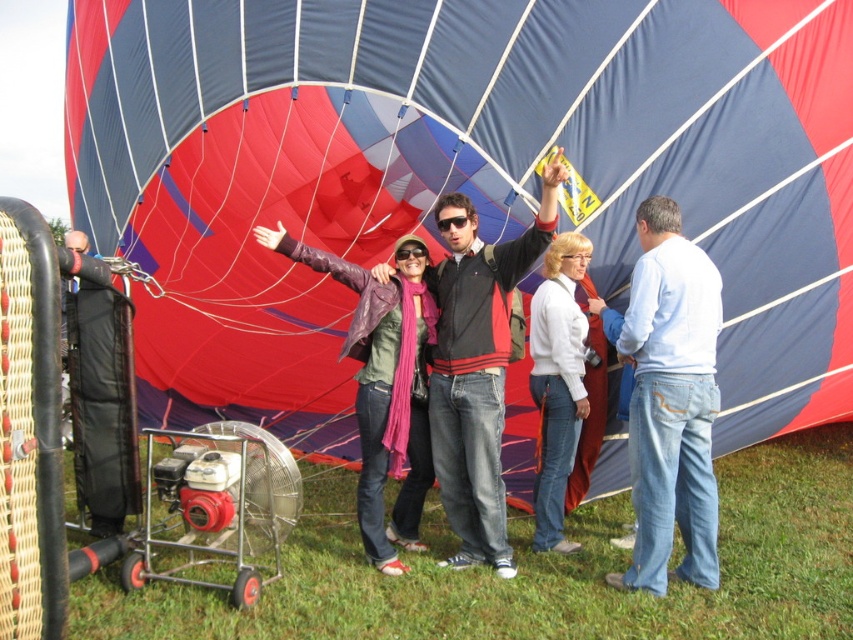
Based on the photo, measure the distance from white cotton shirt at right to black plastic goggles at center.

6.94 feet

Is point (680, 266) farther from camera compared to point (445, 221)?

No, it is in front of (445, 221).

Where is `white cotton shirt at right`? The image size is (853, 640). white cotton shirt at right is located at coordinates (671, 401).

Does white cotton shirt at right have a lesser height compared to purple leather jacket at center?

Incorrect, white cotton shirt at right's height does not fall short of purple leather jacket at center's.

Can you confirm if white cotton shirt at right is wider than purple leather jacket at center?

No, white cotton shirt at right is not wider than purple leather jacket at center.

Is point (640, 225) in front of point (421, 328)?

Yes, it is.

Where is `white cotton shirt at right`? white cotton shirt at right is located at coordinates (671, 401).

Which is more to the left, white matte jacket at center or black plastic goggles at center?

Positioned to the left is black plastic goggles at center.

Who is shorter, white matte jacket at center or black plastic goggles at center?

With less height is black plastic goggles at center.

Locate an element on the screen. The width and height of the screenshot is (853, 640). white matte jacket at center is located at coordinates (556, 381).